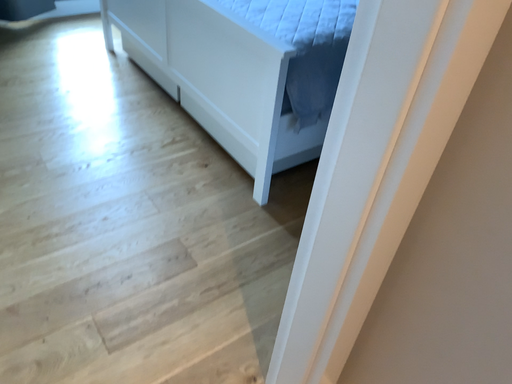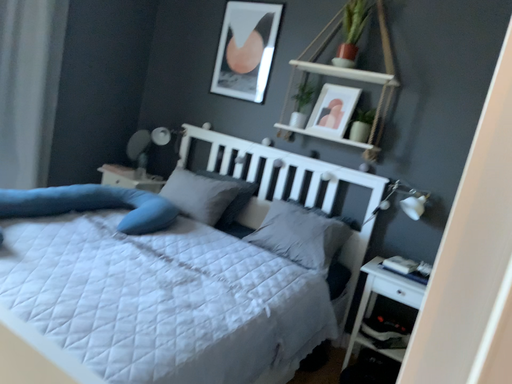
Question: How did the camera likely rotate when shooting the video?

Choices:
 (A) rotated upward
 (B) rotated downward

Answer: (A)